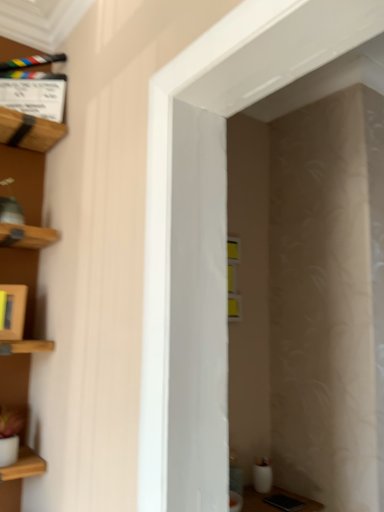
Question: Considering the relative positions of wooden frame at left and white glossy door at center in the image provided, is wooden frame at left to the right of white glossy door at center from the viewer's perspective?

Choices:
 (A) no
 (B) yes

Answer: (A)

Question: Is wooden frame at left facing towards white glossy door at center?

Choices:
 (A) yes
 (B) no

Answer: (B)

Question: Is wooden frame at left thinner than white glossy door at center?

Choices:
 (A) yes
 (B) no

Answer: (A)

Question: Is wooden frame at left smaller than white glossy door at center?

Choices:
 (A) yes
 (B) no

Answer: (A)

Question: Is wooden frame at left positioned beyond the bounds of white glossy door at center?

Choices:
 (A) yes
 (B) no

Answer: (A)

Question: Is point [18, 321] closer or farther from the camera than point [36, 106]?

Choices:
 (A) closer
 (B) farther

Answer: (A)

Question: From a real-world perspective, is wooden frame at left above or below wooden clapperboard at upper left?

Choices:
 (A) below
 (B) above

Answer: (A)

Question: In terms of width, does wooden frame at left look wider or thinner when compared to wooden clapperboard at upper left?

Choices:
 (A) wide
 (B) thin

Answer: (B)

Question: Is wooden frame at left situated inside wooden clapperboard at upper left or outside?

Choices:
 (A) outside
 (B) inside

Answer: (A)

Question: From a real-world perspective, is white glossy door at center above or below wooden frame at left?

Choices:
 (A) below
 (B) above

Answer: (B)

Question: Considering the positions of point (175, 245) and point (11, 287), is point (175, 245) closer or farther from the camera than point (11, 287)?

Choices:
 (A) farther
 (B) closer

Answer: (B)

Question: Do you think white glossy door at center is within wooden frame at left, or outside of it?

Choices:
 (A) inside
 (B) outside

Answer: (B)

Question: Is white glossy door at center taller or shorter than wooden frame at left?

Choices:
 (A) short
 (B) tall

Answer: (B)

Question: In the image, is wooden frame at left on the left side or the right side of white glossy door at center?

Choices:
 (A) right
 (B) left

Answer: (B)

Question: Considering the positions of wooden frame at left and white glossy door at center in the image, is wooden frame at left wider or thinner than white glossy door at center?

Choices:
 (A) thin
 (B) wide

Answer: (A)